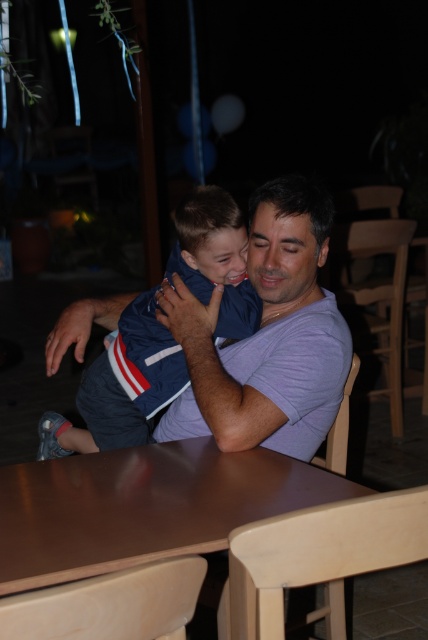
You are a parent holding a blue fabric baby at center and want to place it on the brown wooden table at center. Can you safely put the baby on the table without it falling off?

The distance between the brown wooden table at center and the blue fabric baby at center is 16.58 inches. Since the baby is being held at that distance, placing it directly on the table should be safe as the distance is manageable for a parent to reach and ensure stability.

You are a photographer setting up for a family portrait. You have a brown wooden table at center and a blue fabric baby at center in the scene. To ensure the baby is visible, where should you position the camera relative to the table?

Since the brown wooden table at center is shorter than the blue fabric baby at center, positioning the camera slightly above the table level would allow the baby to be clearly visible without obstruction.

You are a photographer standing at the point marked as point (x=253, y=512). You want to capture a photo of the man and the boy sitting at the wooden table. Considering the distance between them, will you need to adjust your camera settings for a wide angle to include both in the frame?

The man and the boy are 4.14 feet apart. To include both in the frame from your position at point (x=253, y=512), you may need a wide angle setting to accommodate the distance between them.